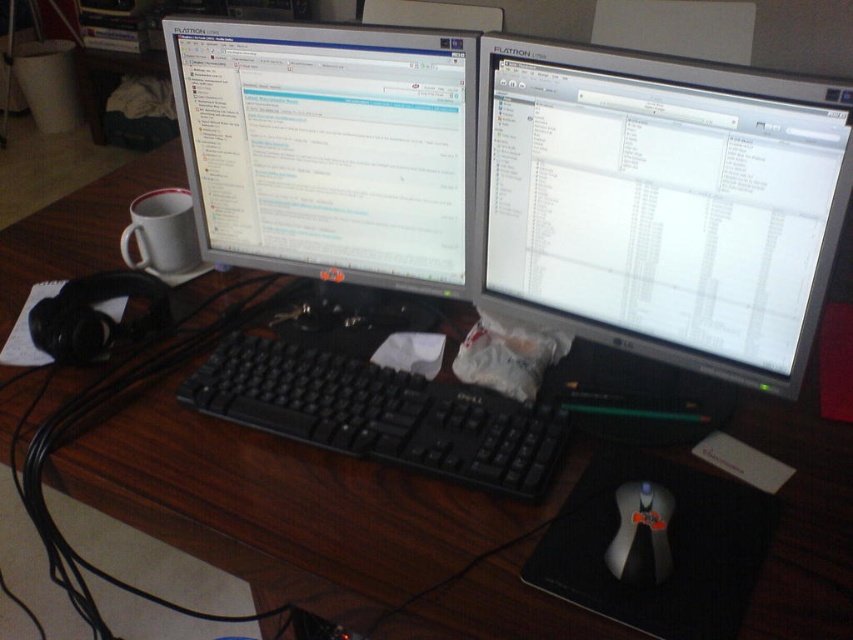
From the picture: You are setting up a new webcam for a video call. The webcam has a recommended placement area of 0.3 to 0.8 on the X and Y axes. Based on the coordinates provided in the description, will the silver metallic monitor at center be within the recommended placement area for the webcam?

The silver metallic monitor at center is positioned at point (660, 204), which falls within the recommended placement area of 0.3 to 0.8 on both the X and Y axes. Therefore, placing the webcam here would be suitable.

You are a remote worker who needs to reach the black plastic mouse at center from the silver metallic monitor at center. Can you comfortably reach it with your hand without moving your chair?

The distance between the silver metallic monitor at center and the black plastic mouse at center is 11.49 inches, which is a comfortable reach for most people, so yes, you can comfortably reach it without moving your chair.

You are organizing a desk and need to place a new item between the silver metallic monitor at center and the black plastic mouse at center. Which object should you place the item closer to if you want it to be near the larger object?

You should place the item closer to the silver metallic monitor at center because it is larger than the black plastic mouse at center.